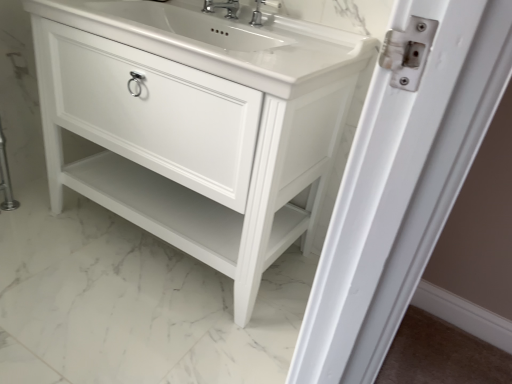
Question: In which direction should I rotate to look at polished chrome faucet at upper center, which is the 1th tap from right to left?

Choices:
 (A) right
 (B) left

Answer: (A)

Question: Is white glossy cabinet at center a part of polished chrome faucet at upper center, positioned as the 2th tap in left-to-right order?

Choices:
 (A) no
 (B) yes

Answer: (A)

Question: Does polished chrome faucet at upper center, which is the 1th tap from right to left, have a larger size compared to white glossy cabinet at center?

Choices:
 (A) yes
 (B) no

Answer: (B)

Question: Considering the relative sizes of polished chrome faucet at upper center, positioned as the 2th tap in left-to-right order, and white glossy cabinet at center in the image provided, is polished chrome faucet at upper center, positioned as the 2th tap in left-to-right order, taller than white glossy cabinet at center?

Choices:
 (A) yes
 (B) no

Answer: (B)

Question: From a real-world perspective, is polished chrome faucet at upper center, which is the 1th tap from right to left, on white glossy cabinet at center?

Choices:
 (A) yes
 (B) no

Answer: (A)

Question: Are polished chrome faucet at upper center, which is the 1th tap from right to left, and white glossy cabinet at center located far from each other?

Choices:
 (A) no
 (B) yes

Answer: (A)

Question: Is polished chrome faucet at upper center, which is the 1th tap from right to left, beside white glossy cabinet at center?

Choices:
 (A) no
 (B) yes

Answer: (A)

Question: Can you confirm if white glossy cabinet at center is smaller than polished chrome faucet at upper center, positioned as the 2th tap in left-to-right order?

Choices:
 (A) yes
 (B) no

Answer: (B)

Question: Does white glossy cabinet at center have a larger size compared to polished chrome faucet at upper center, which is the 1th tap from right to left?

Choices:
 (A) yes
 (B) no

Answer: (A)

Question: Considering the relative sizes of white glossy cabinet at center and polished chrome faucet at upper center, positioned as the 2th tap in left-to-right order, in the image provided, is white glossy cabinet at center taller than polished chrome faucet at upper center, positioned as the 2th tap in left-to-right order,?

Choices:
 (A) yes
 (B) no

Answer: (A)

Question: Would you say white glossy cabinet at center is a long distance from polished chrome faucet at upper center, which is the 1th tap from right to left?

Choices:
 (A) no
 (B) yes

Answer: (A)

Question: Is white glossy cabinet at center to the right of polished chrome faucet at upper center, which is the 1th tap from right to left, from the viewer's perspective?

Choices:
 (A) yes
 (B) no

Answer: (B)

Question: From a real-world perspective, is white glossy cabinet at center positioned over polished chrome faucet at upper center, positioned as the 2th tap in left-to-right order, based on gravity?

Choices:
 (A) yes
 (B) no

Answer: (B)

Question: From the image's perspective, is polished chrome faucet at upper center, positioned as the 2th tap in left-to-right order, above polished chrome faucet at upper center, the 2th tap from the right?

Choices:
 (A) no
 (B) yes

Answer: (A)